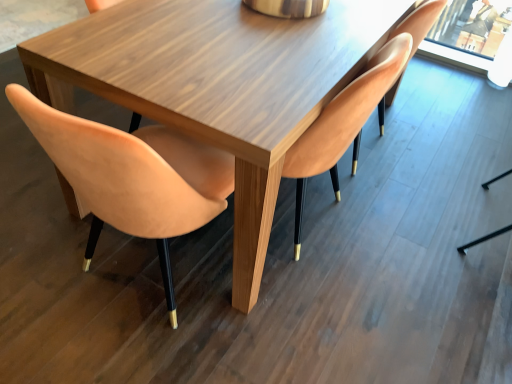
What are the coordinates of `free location in front of suede-like peach chair at left, which is counted as the first chair, starting from the left` in the screenshot? It's located at (130, 350).